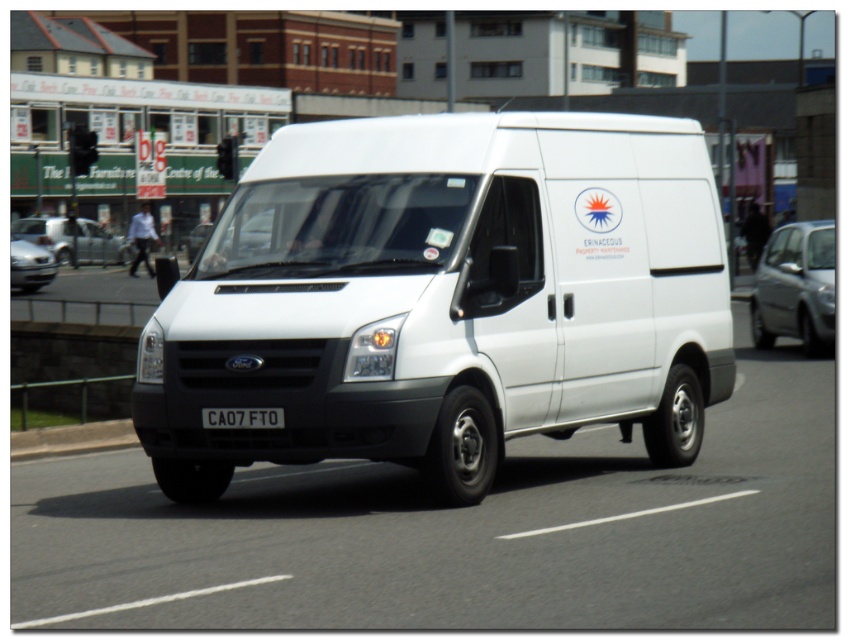
Who is more forward, (801,292) or (86,436)?

Point (86,436) is in front.

Between silver metallic hatchback at right and gray concrete curb at lower left, which one is positioned higher?

Positioned higher is silver metallic hatchback at right.

Is point (800, 243) closer to camera compared to point (100, 426)?

No.

I want to click on silver metallic hatchback at right, so point(795,285).

Does point (94, 224) come farther from viewer compared to point (53, 268)?

Yes, it is behind point (53, 268).

Image resolution: width=846 pixels, height=640 pixels. Identify the location of silver metallic sedan at center. (70, 240).

This screenshot has width=846, height=640. Describe the element at coordinates (70, 240) in the screenshot. I see `silver metallic sedan at center` at that location.

What are the coordinates of `silver metallic sedan at center` in the screenshot? It's located at (70, 240).

How distant is gray concrete curb at lower left from matte black car at left?

gray concrete curb at lower left is 20.76 meters away from matte black car at left.

At what (x,y) coordinates should I click in order to perform the action: click on gray concrete curb at lower left. Please return your answer as a coordinate pair (x, y). The image size is (846, 640). Looking at the image, I should click on (70, 438).